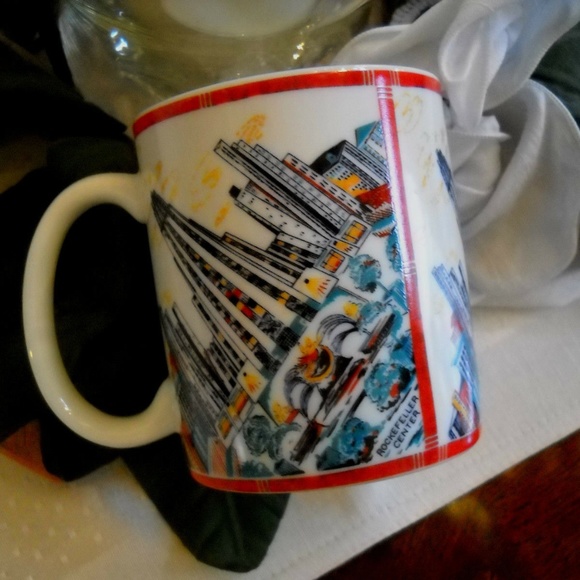
This screenshot has height=580, width=580. I want to click on cup handle, so click(x=37, y=326).